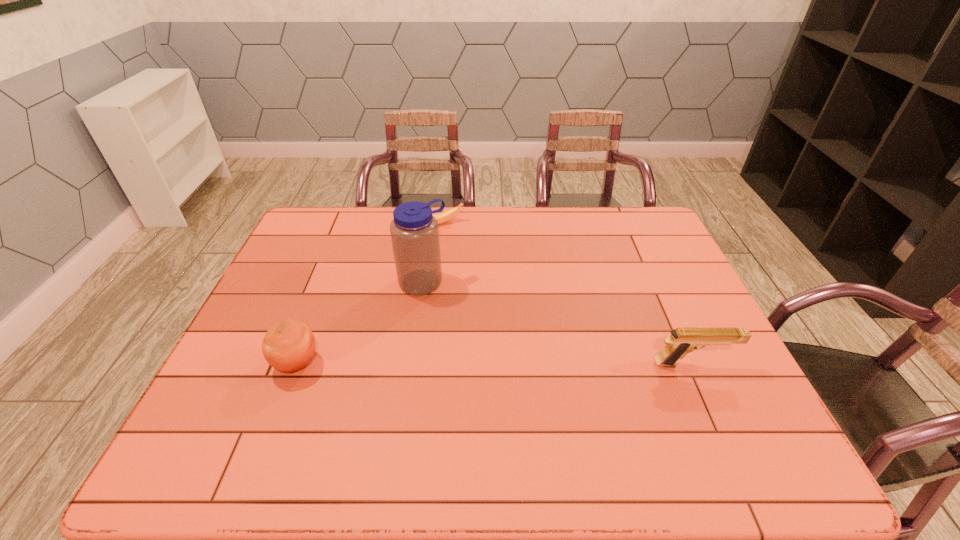
Locate an element on the screen. This screenshot has width=960, height=540. free space on the desktop that is between the orange and the pistol and is positioned at the stem of the banana is located at coordinates (554, 363).

At what (x,y) coordinates should I click in order to perform the action: click on free space on the desktop that is between the orange and the rightmost object and is positioned with a carrying loop on the side of the third nearest object. Please return your answer as a coordinate pair (x, y). The image size is (960, 540). Looking at the image, I should click on [488, 363].